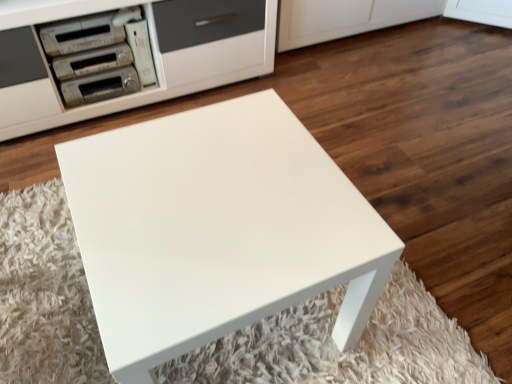
The image size is (512, 384). What are the coordinates of `vacant space in front of white plastic game console at upper left, the third appliance positioned from the front` in the screenshot? It's located at (143, 102).